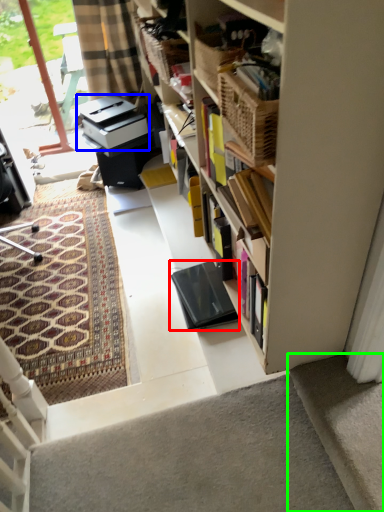
Question: Which is nearer to the equipment (highlighted by a red box)? printer (highlighted by a blue box) or concrete (highlighted by a green box).

Choices:
 (A) printer
 (B) concrete

Answer: (B)